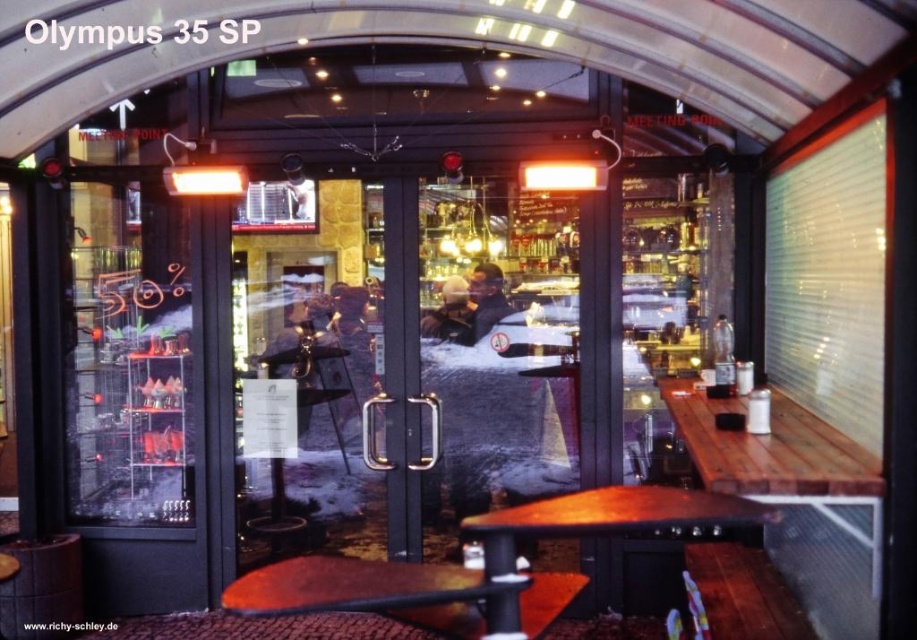
You are a customer entering the cozy cafe and want to sit at the brown wooden table at center. However, you notice the wooden table at right is in your way. Can you walk around it to reach your desired table?

The brown wooden table at center is behind the wooden table at right, so you can walk around the wooden table at right to reach the brown wooden table at center.